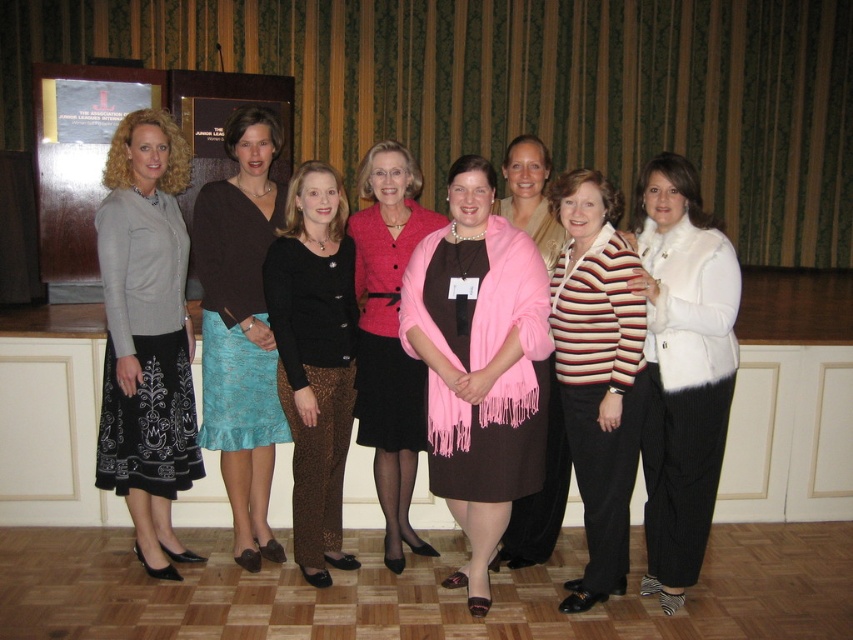
Can you confirm if white fur vest at center is taller than black lace pants at center?

Correct, white fur vest at center is much taller as black lace pants at center.

From the picture: Does white fur vest at center appear on the left side of black lace pants at center?

Incorrect, white fur vest at center is not on the left side of black lace pants at center.

Locate an element on the screen. white fur vest at center is located at coordinates (682, 369).

The width and height of the screenshot is (853, 640). I want to click on white fur vest at center, so [x=682, y=369].

Does pink fabric shawl at center have a larger size compared to striped knit sweater at center?

Indeed, pink fabric shawl at center has a larger size compared to striped knit sweater at center.

Can you confirm if pink fabric shawl at center is wider than striped knit sweater at center?

Yes.

The width and height of the screenshot is (853, 640). I want to click on pink fabric shawl at center, so click(x=479, y=364).

Between pink fabric shawl at center and matte black skirt at left, which one is positioned higher?

matte black skirt at left

Is pink fabric shawl at center bigger than matte black skirt at left?

Indeed, pink fabric shawl at center has a larger size compared to matte black skirt at left.

Locate an element on the screen. The width and height of the screenshot is (853, 640). pink fabric shawl at center is located at coordinates (479, 364).